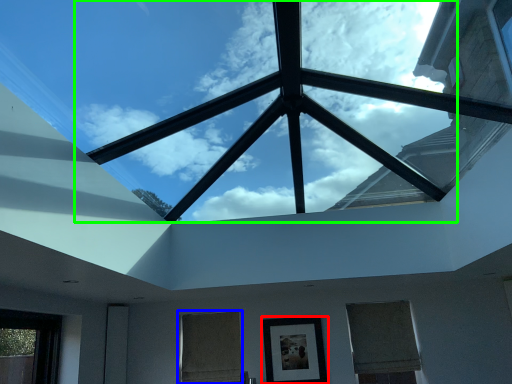
Question: Which is farther away from picture frame (highlighted by a red box)? window (highlighted by a blue box) or cloud (highlighted by a green box)?

Choices:
 (A) window
 (B) cloud

Answer: (B)